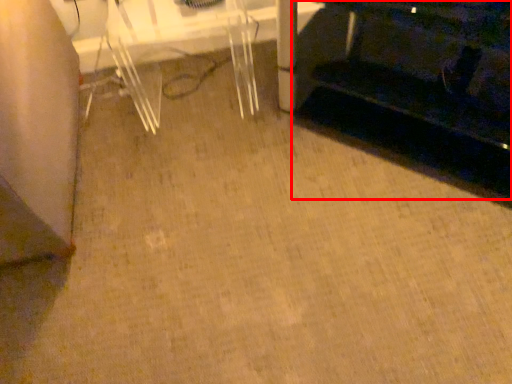
Question: From the image's perspective, what is the correct spatial relationship of furniture (annotated by the red box) in relation to table?

Choices:
 (A) above
 (B) below

Answer: (B)